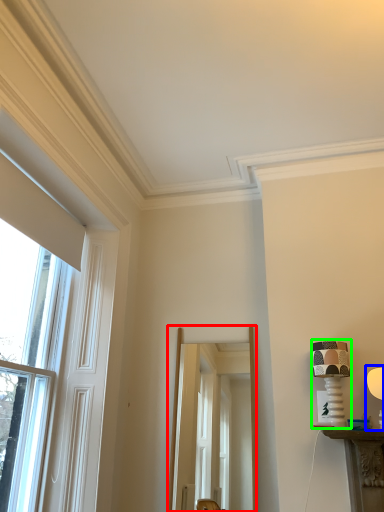
Question: Which object is positioned farthest from screen door (highlighted by a red box)? Select from table lamp (highlighted by a blue box) and table lamp (highlighted by a green box).

Choices:
 (A) table lamp
 (B) table lamp

Answer: (A)